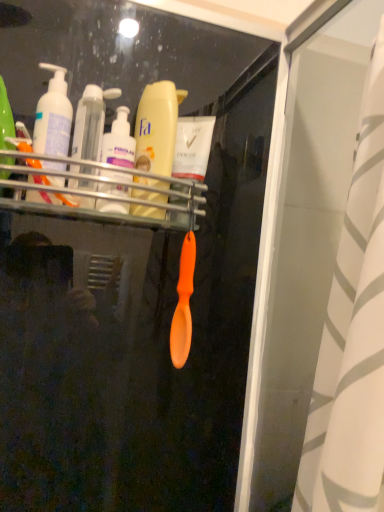
Question: Choose the correct answer: Is matte white pump bottle at left inside yellow matte lotion at center or outside it?

Choices:
 (A) inside
 (B) outside

Answer: (B)

Question: In terms of height, does matte white pump bottle at left look taller or shorter compared to yellow matte lotion at center?

Choices:
 (A) short
 (B) tall

Answer: (A)

Question: Which of these objects is positioned closest to the translucent plastic bottles at center left, the second toiletry when ordered from right to left?

Choices:
 (A) yellow matte lotion at center
 (B) white striped fabric at right
 (C) translucent plastic bottles at center, arranged as the second toiletry when viewed from the left
 (D) matte white pump bottle at left

Answer: (C)

Question: Which object is the closest to the translucent plastic bottles at center, marked as the first toiletry in a right-to-left arrangement?

Choices:
 (A) translucent plastic bottles at center left, which ranks as the 1th toiletry in left-to-right order
 (B) matte white pump bottle at left
 (C) white striped fabric at right
 (D) yellow matte lotion at center

Answer: (A)